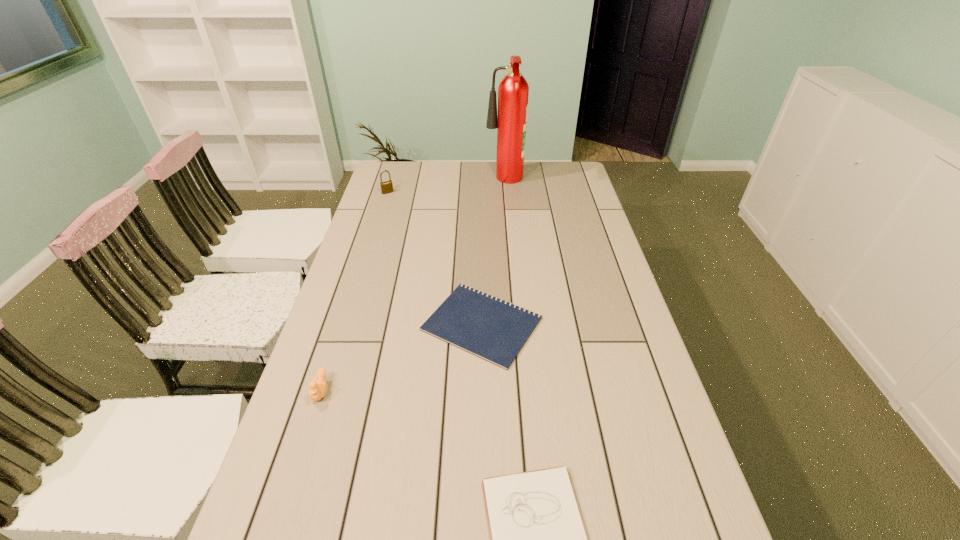
Where is `the tallest object`? The image size is (960, 540). the tallest object is located at coordinates point(513,90).

Find the location of a particular element. Image resolution: width=960 pixels, height=540 pixels. padlock is located at coordinates (386, 187).

Where is `the second nearest object`? the second nearest object is located at coordinates (317, 389).

This screenshot has width=960, height=540. Find the location of `the third tallest object`. the third tallest object is located at coordinates (317, 389).

Identify the location of the shorter notepad. (495, 330).

Locate an element on the screen. the third nearest object is located at coordinates (495, 330).

I want to click on vacant position located 0.250m at the nozzle of the fire extinguisher, so click(x=427, y=181).

Locate an element on the screen. Image resolution: width=960 pixels, height=540 pixels. vacant position located at the nozzle of the fire extinguisher is located at coordinates (414, 181).

The image size is (960, 540). I want to click on vacant space located at the nozzle of the fire extinguisher, so click(399, 181).

Locate an element on the screen. This screenshot has height=540, width=960. vacant region located on the front of the padlock is located at coordinates (384, 205).